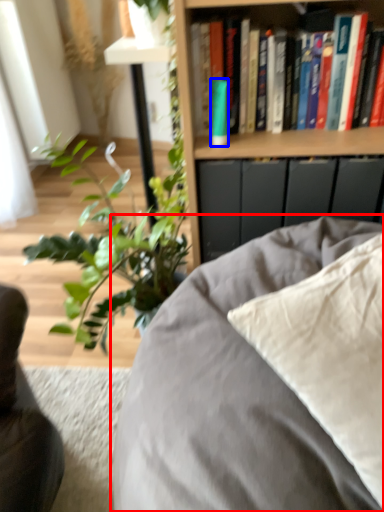
Question: Which point is further to the camera, furniture (highlighted by a red box) or paperback book (highlighted by a blue box)?

Choices:
 (A) furniture
 (B) paperback book

Answer: (B)